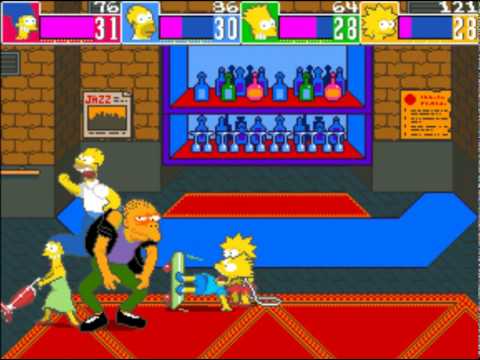
Locate an element on the screen. wine glasses is located at coordinates (259, 149).